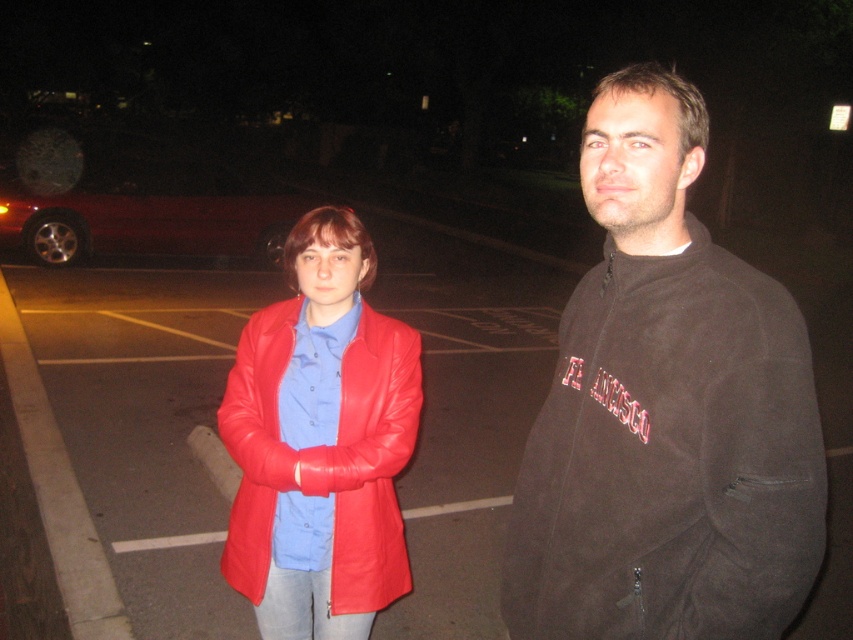
You are a photographer setting up a camera to capture the scene. You need to ensure that both the shiny red leather jacket at center and the shiny red car at left are in focus. Given that your camera has a depth of field that can cover objects within a 10 meter range, will both objects be in focus?

The shiny red leather jacket at center and shiny red car at left are 9.12 meters apart from each other. Since the distance between them is within the 10 meter range of the camera, both objects will be in focus.

You are standing in the parking lot and want to locate the point at coordinates (666, 412). Which object is this point located on?

The point at coordinates (666, 412) is located on the dark brown fleece jacket at center.

You are a security guard in a parking lot at night. You see a dark brown fleece jacket at center and a shiny red car at left. Which object is closer to the entrance of the parking lot if the entrance is on the left side of the image?

The shiny red car at left is closer to the entrance on the left side because it is positioned to the left of the dark brown fleece jacket at center.